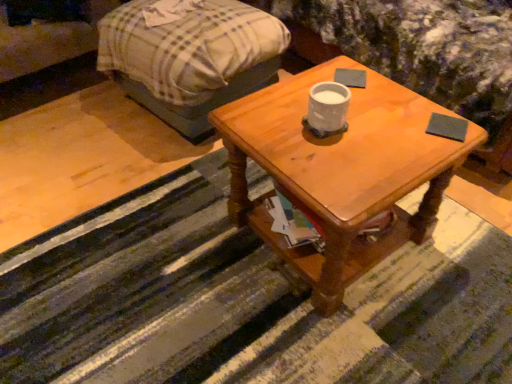
Question: Does dark gray matte pad at upper right, the first pad when ordered from right to left, appear on the left side of wooden coffee table at center?

Choices:
 (A) no
 (B) yes

Answer: (A)

Question: Is dark gray matte pad at upper right, acting as the first pad starting from the bottom, facing towards wooden coffee table at center?

Choices:
 (A) no
 (B) yes

Answer: (B)

Question: Would you say wooden coffee table at center is part of dark gray matte pad at upper right, the second pad in the left-to-right sequence,'s contents?

Choices:
 (A) yes
 (B) no

Answer: (B)

Question: Considering the relative positions of dark gray matte pad at upper right, the first pad when ordered from right to left, and wooden coffee table at center in the image provided, is dark gray matte pad at upper right, the first pad when ordered from right to left, to the right of wooden coffee table at center from the viewer's perspective?

Choices:
 (A) yes
 (B) no

Answer: (A)

Question: Does dark gray matte pad at upper right, acting as the first pad starting from the bottom, have a lesser height compared to wooden coffee table at center?

Choices:
 (A) no
 (B) yes

Answer: (B)

Question: In terms of height, does wooden table at center look taller or shorter compared to wooden coffee table at center?

Choices:
 (A) short
 (B) tall

Answer: (A)

Question: In the image, is wooden table at center positioned in front of or behind wooden coffee table at center?

Choices:
 (A) behind
 (B) front

Answer: (B)

Question: Considering the positions of wooden table at center and wooden coffee table at center in the image, is wooden table at center wider or thinner than wooden coffee table at center?

Choices:
 (A) thin
 (B) wide

Answer: (B)

Question: From a real-world perspective, is wooden table at center physically located above or below wooden coffee table at center?

Choices:
 (A) above
 (B) below

Answer: (B)

Question: From the image's perspective, is wooden table at center positioned above or below plaid fabric couch at upper left?

Choices:
 (A) above
 (B) below

Answer: (B)

Question: Is wooden table at center wider or thinner than plaid fabric couch at upper left?

Choices:
 (A) thin
 (B) wide

Answer: (B)

Question: Would you say wooden table at center is to the left or to the right of plaid fabric couch at upper left in the picture?

Choices:
 (A) right
 (B) left

Answer: (A)

Question: Is wooden table at center inside the boundaries of plaid fabric couch at upper left, or outside?

Choices:
 (A) outside
 (B) inside

Answer: (A)

Question: From their relative heights in the image, would you say wooden coffee table at center is taller or shorter than plaid fabric bed at upper left?

Choices:
 (A) tall
 (B) short

Answer: (B)

Question: From a real-world perspective, is wooden coffee table at center physically located above or below plaid fabric bed at upper left?

Choices:
 (A) below
 (B) above

Answer: (B)